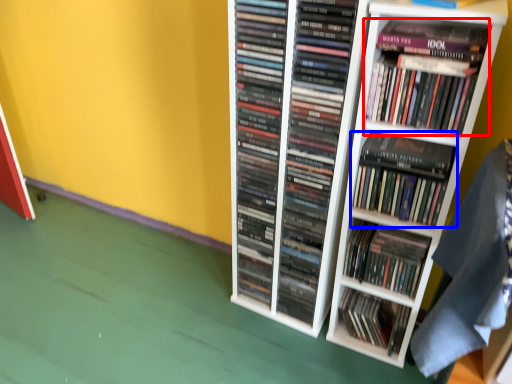
Question: Which point is closer to the camera, book (highlighted by a red box) or book (highlighted by a blue box)?

Choices:
 (A) book
 (B) book

Answer: (A)